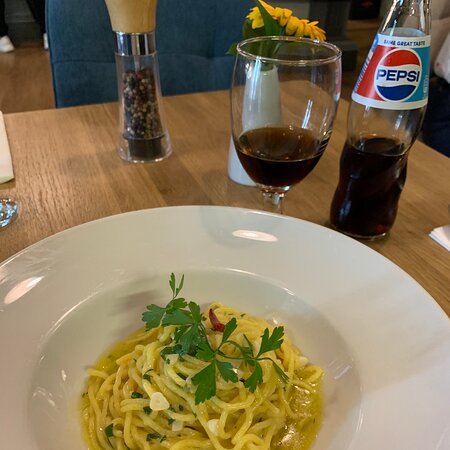
In order to click on 1 pepper shaker in this screenshot , I will do `click(137, 101)`.